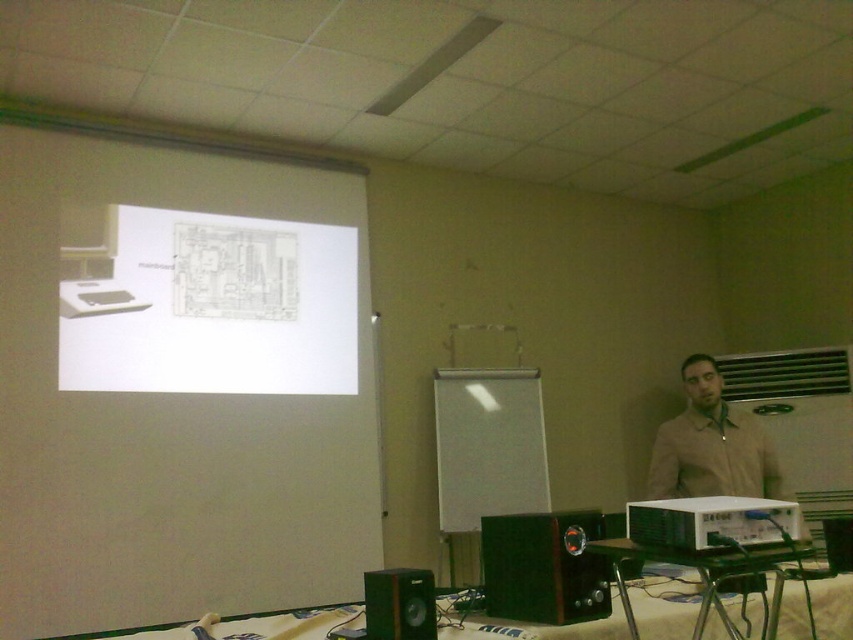
Question: Which of the following is the closest to the observer?

Choices:
 (A) white matte projection screen at center
 (B) green matte speaker at lower center
 (C) white plastic projector at center
 (D) black plastic speaker at lower center

Answer: (C)

Question: Which of the following is the closest to the observer?

Choices:
 (A) white matte projection screen at center
 (B) black plastic speaker at lower center
 (C) metallic green table at lower center
 (D) white paper at upper left

Answer: (C)

Question: Which object is closer to the camera taking this photo?

Choices:
 (A) green matte speaker at lower center
 (B) white plastic projector at center
 (C) metallic green table at lower center

Answer: (C)

Question: Observing the image, what is the correct spatial positioning of black plastic speaker at lower center in reference to beige fabric shirt at right?

Choices:
 (A) right
 (B) left

Answer: (B)

Question: Observing the image, what is the correct spatial positioning of white matte projection screen at center in reference to metallic green table at lower center?

Choices:
 (A) below
 (B) above

Answer: (B)

Question: Can you confirm if white matte projection screen at center is smaller than green matte speaker at lower center?

Choices:
 (A) yes
 (B) no

Answer: (B)